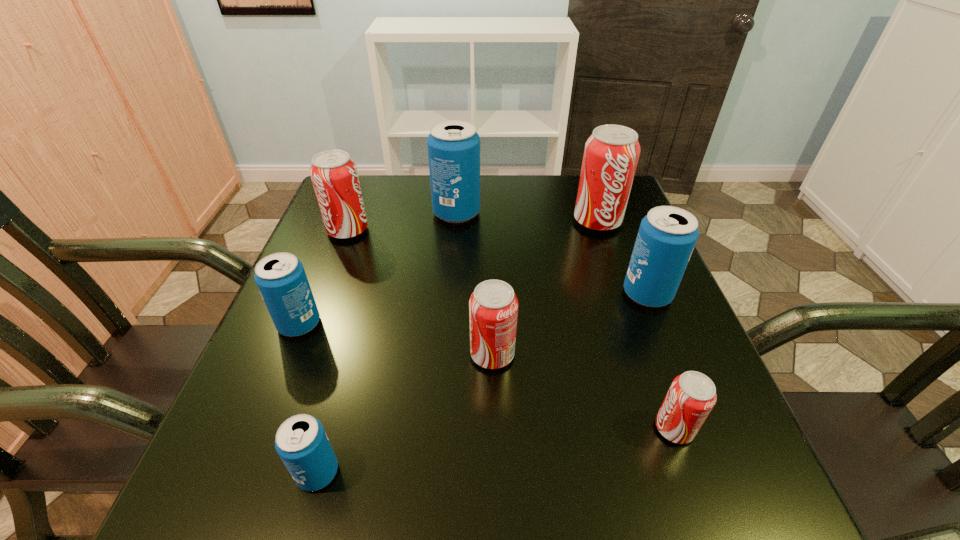
The height and width of the screenshot is (540, 960). Find the location of `the biggest blue soda can`. the biggest blue soda can is located at coordinates click(x=453, y=146).

I want to click on the second blue soda can from right to left, so click(453, 146).

This screenshot has height=540, width=960. I want to click on the biggest red soda can, so click(x=611, y=154).

You are a GUI agent. You are given a task and a screenshot of the screen. Output one action in this format:
    pyautogui.click(x=<x>, y=<y>)
    Task: Click on the leftmost red soda can
    Image resolution: width=960 pixels, height=540 pixels.
    Given the screenshot: What is the action you would take?
    pyautogui.click(x=334, y=175)

At what (x,y) coordinates should I click in order to perform the action: click on the rightmost blue soda can. Please return your answer as a coordinate pair (x, y). The height and width of the screenshot is (540, 960). Looking at the image, I should click on (667, 235).

This screenshot has height=540, width=960. Find the location of `the second smallest red soda can`. the second smallest red soda can is located at coordinates (493, 306).

The width and height of the screenshot is (960, 540). What are the coordinates of `the second nearest red soda can` in the screenshot? It's located at (493, 306).

In order to click on the leftmost blue soda can in this screenshot , I will do `click(280, 277)`.

At what (x,y) coordinates should I click in order to perform the action: click on the seventh farthest object. Please return your answer as a coordinate pair (x, y). This screenshot has height=540, width=960. Looking at the image, I should click on (692, 395).

Locate an element on the screen. Image resolution: width=960 pixels, height=540 pixels. the second nearest soda can is located at coordinates (692, 395).